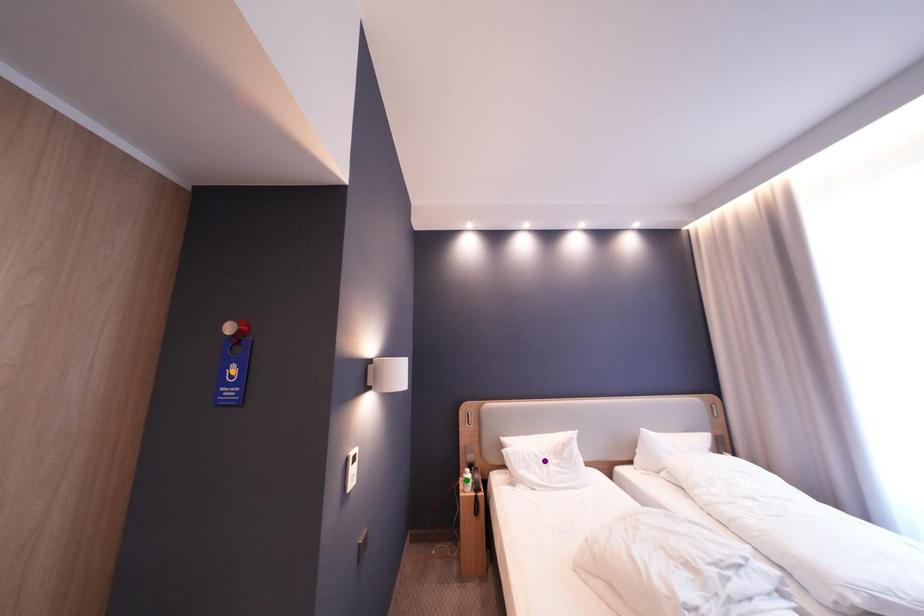
Order these from nearest to farthest:
1. green point
2. orange point
3. purple point

orange point
purple point
green point